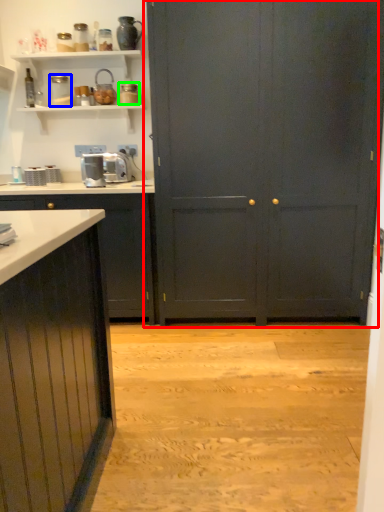
Question: Which object is positioned closest to cupboard (highlighted by a red box)? Select from appliance (highlighted by a blue box) and appliance (highlighted by a green box).

Choices:
 (A) appliance
 (B) appliance

Answer: (B)